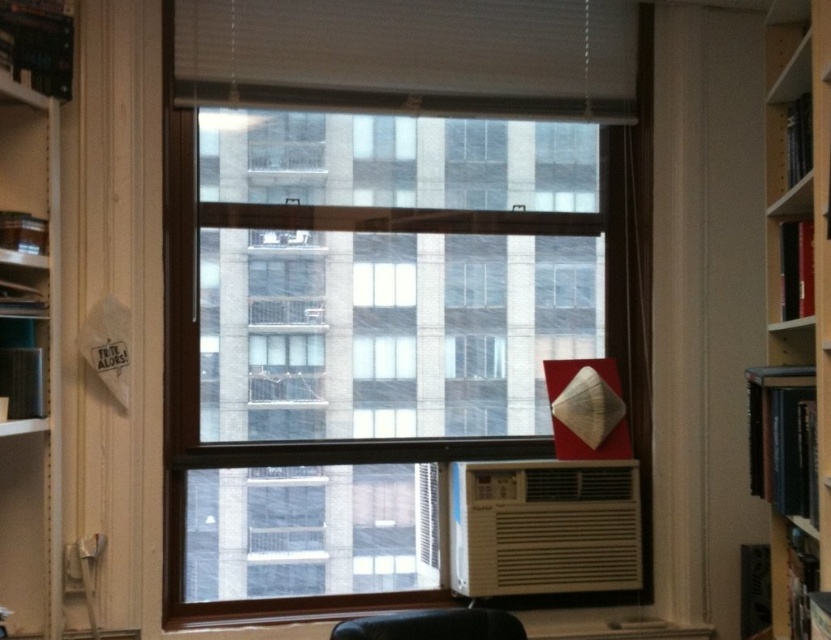
You are a delivery person trying to place a package that is 1.2 meters long between the wooden bookshelf at right and the black leather armchair at lower center. Can you fit the package horizontally between them?

The wooden bookshelf at right and the black leather armchair at lower center are 1.02 meters apart from each other. Since the package is 1.2 meters long, which is longer than the space between them, you cannot fit the package horizontally between them.

From the picture: You are organizing a bookshelf and need to place a large painting that is the same size as the transparent glass window at center. Can the wooden bookshelf at right hold this painting?

The transparent glass window at center is bigger than wooden bookshelf at right. Therefore, the wooden bookshelf at right cannot hold the painting as it is smaller than the window.